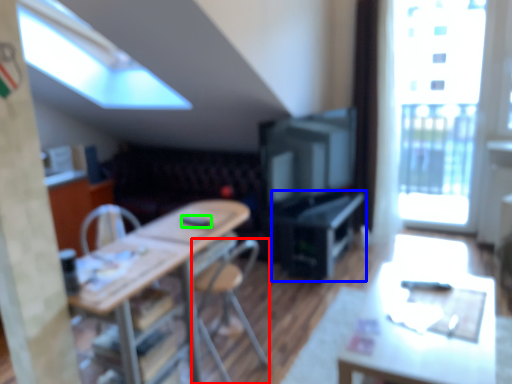
Question: Estimate the real-world distances between objects in this image. Which object is closer to chair (highlighted by a red box), computer desk (highlighted by a blue box) or remote control (highlighted by a green box)?

Choices:
 (A) computer desk
 (B) remote control

Answer: (B)